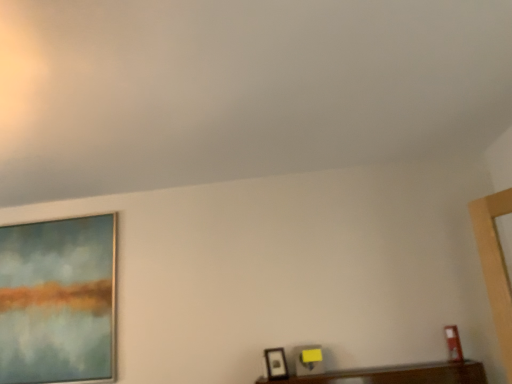
Where is `matte black picture frame at lower center, positioned as the second picture frame in left-to-right order`? This screenshot has height=384, width=512. matte black picture frame at lower center, positioned as the second picture frame in left-to-right order is located at coordinates (276, 364).

You are a GUI agent. You are given a task and a screenshot of the screen. Output one action in this format:
    pyautogui.click(x=<x>, y=<y>)
    Task: Click on the matte black picture frame at lower center, positioned as the second picture frame in left-to-right order
    
    Given the screenshot: What is the action you would take?
    pyautogui.click(x=276, y=364)

Which of these two, matte glass painting at left, acting as the third picture frame starting from the right, or matte black picture frame at lower center, the second picture frame positioned from the front, is wider?

Wider between the two is matte black picture frame at lower center, the second picture frame positioned from the front.

Considering the relative sizes of matte glass painting at left, which is counted as the 3th picture frame, starting from the front, and matte black picture frame at lower center, arranged as the 2th picture frame when viewed from the back, in the image provided, is matte glass painting at left, which is counted as the 3th picture frame, starting from the front, bigger than matte black picture frame at lower center, arranged as the 2th picture frame when viewed from the back,?

Yes, matte glass painting at left, which is counted as the 3th picture frame, starting from the front, is bigger than matte black picture frame at lower center, arranged as the 2th picture frame when viewed from the back.

Who is shorter, matte glass painting at left, acting as the third picture frame starting from the right, or matte black picture frame at lower center, the second picture frame from the right?

With less height is matte black picture frame at lower center, the second picture frame from the right.

Is matte black picture frame at lower center, positioned as the second picture frame in left-to-right order, inside or outside of matte black picture frame at lower right, the 1th picture frame positioned from the front?

matte black picture frame at lower center, positioned as the second picture frame in left-to-right order, cannot be found inside matte black picture frame at lower right, the 1th picture frame positioned from the front.

Is point (281, 364) positioned behind point (455, 339)?

Yes, point (281, 364) is behind point (455, 339).

Considering the sizes of objects matte black picture frame at lower center, the second picture frame positioned from the front, and matte black picture frame at lower right, the 1th picture frame from the right, in the image provided, who is bigger, matte black picture frame at lower center, the second picture frame positioned from the front, or matte black picture frame at lower right, the 1th picture frame from the right,?

Bigger between the two is matte black picture frame at lower center, the second picture frame positioned from the front.

Can you see matte black picture frame at lower center, arranged as the 2th picture frame when viewed from the back, touching matte black picture frame at lower right, the 3th picture frame positioned from the back?

No, matte black picture frame at lower center, arranged as the 2th picture frame when viewed from the back, is not making contact with matte black picture frame at lower right, the 3th picture frame positioned from the back.

Is matte black picture frame at lower right, the 1th picture frame positioned from the front, located within matte glass painting at left, which is counted as the 3th picture frame, starting from the front?

No, matte black picture frame at lower right, the 1th picture frame positioned from the front, is not a part of matte glass painting at left, which is counted as the 3th picture frame, starting from the front.

Which is behind, point (111, 335) or point (453, 340)?

The point (111, 335) is farther.

Is matte glass painting at left, acting as the third picture frame starting from the right, touching matte black picture frame at lower right, the 1th picture frame positioned from the front?

matte glass painting at left, acting as the third picture frame starting from the right, and matte black picture frame at lower right, the 1th picture frame positioned from the front, are clearly separated.

Considering the relative sizes of matte glass painting at left, acting as the third picture frame starting from the right, and matte black picture frame at lower right, the 3th picture frame positioned from the back, in the image provided, is matte glass painting at left, acting as the third picture frame starting from the right, taller than matte black picture frame at lower right, the 3th picture frame positioned from the back,?

Correct, matte glass painting at left, acting as the third picture frame starting from the right, is much taller as matte black picture frame at lower right, the 3th picture frame positioned from the back.

Is matte black picture frame at lower center, the second picture frame positioned from the front, facing towards matte glass painting at left, acting as the third picture frame starting from the right?

No, matte black picture frame at lower center, the second picture frame positioned from the front, is not aimed at matte glass painting at left, acting as the third picture frame starting from the right.

Is matte black picture frame at lower center, the second picture frame from the right, located outside matte glass painting at left, which is the 1th picture frame from back to front?

matte black picture frame at lower center, the second picture frame from the right, is positioned outside matte glass painting at left, which is the 1th picture frame from back to front.

Is point (280, 371) farther from camera compared to point (37, 353)?

No, it is not.

Does matte black picture frame at lower right, the 1th picture frame positioned from the front, come in front of matte glass painting at left, which is counted as the 3th picture frame, starting from the front?

Yes, matte black picture frame at lower right, the 1th picture frame positioned from the front, is in front of matte glass painting at left, which is counted as the 3th picture frame, starting from the front.

Is matte black picture frame at lower right, the 1th picture frame from the right, bigger than matte glass painting at left, positioned as the first picture frame in left-to-right order?

No, matte black picture frame at lower right, the 1th picture frame from the right, is not bigger than matte glass painting at left, positioned as the first picture frame in left-to-right order.

This screenshot has height=384, width=512. In order to click on picture frame that appears above the matte black picture frame at lower right, the 1th picture frame from the right (from a real-world perspective) in this screenshot , I will do `click(58, 301)`.

Is matte black picture frame at lower right, which is counted as the third picture frame, starting from the left, positioned far away from matte black picture frame at lower center, arranged as the 2th picture frame when viewed from the back?

Indeed, matte black picture frame at lower right, which is counted as the third picture frame, starting from the left, is not near matte black picture frame at lower center, arranged as the 2th picture frame when viewed from the back.

Is the position of matte black picture frame at lower right, the 1th picture frame from the right, more distant than that of matte black picture frame at lower center, arranged as the 2th picture frame when viewed from the back?

No, matte black picture frame at lower right, the 1th picture frame from the right, is in front of matte black picture frame at lower center, arranged as the 2th picture frame when viewed from the back.

Is matte black picture frame at lower right, the 1th picture frame positioned from the front, taller than matte black picture frame at lower center, the second picture frame positioned from the front?

Yes.

Find the location of `the 1st picture frame in front when counting from the matte glass painting at left, which is the 1th picture frame from back to front`. the 1st picture frame in front when counting from the matte glass painting at left, which is the 1th picture frame from back to front is located at coordinates (276, 364).

This screenshot has width=512, height=384. There is a matte black picture frame at lower center, arranged as the 2th picture frame when viewed from the back. In order to click on the 1st picture frame above it (from a real-world perspective) in this screenshot , I will do `click(453, 343)`.

Which object lies further to the anchor point matte glass painting at left, acting as the third picture frame starting from the right, matte black picture frame at lower center, the second picture frame from the right, or matte black picture frame at lower right, the 1th picture frame from the right?

matte black picture frame at lower right, the 1th picture frame from the right, is further to matte glass painting at left, acting as the third picture frame starting from the right.

When comparing their distances from matte glass painting at left, which is the 1th picture frame from back to front, does matte black picture frame at lower right, the 1th picture frame from the right, or matte black picture frame at lower center, the second picture frame from the right, seem further?

matte black picture frame at lower right, the 1th picture frame from the right.

Considering their positions, is matte glass painting at left, which is counted as the 3th picture frame, starting from the front, positioned closer to matte black picture frame at lower right, the 1th picture frame positioned from the front, than matte black picture frame at lower center, the second picture frame from the right?

matte black picture frame at lower center, the second picture frame from the right.

Which object lies further to the anchor point matte black picture frame at lower center, positioned as the second picture frame in left-to-right order, matte black picture frame at lower right, the 3th picture frame positioned from the back, or matte glass painting at left, which is counted as the 3th picture frame, starting from the front?

Based on the image, matte glass painting at left, which is counted as the 3th picture frame, starting from the front, appears to be further to matte black picture frame at lower center, positioned as the second picture frame in left-to-right order.

Estimate the real-world distances between objects in this image. Which object is further from matte black picture frame at lower center, arranged as the 2th picture frame when viewed from the back, matte glass painting at left, acting as the third picture frame starting from the right, or matte black picture frame at lower right, the 1th picture frame positioned from the front?

The object further to matte black picture frame at lower center, arranged as the 2th picture frame when viewed from the back, is matte glass painting at left, acting as the third picture frame starting from the right.

From the image, which object appears to be farther from matte black picture frame at lower right, which is counted as the third picture frame, starting from the left, matte black picture frame at lower center, positioned as the second picture frame in left-to-right order, or matte glass painting at left, positioned as the first picture frame in left-to-right order?

Based on the image, matte glass painting at left, positioned as the first picture frame in left-to-right order, appears to be further to matte black picture frame at lower right, which is counted as the third picture frame, starting from the left.

Locate an element on the screen. picture frame between matte glass painting at left, acting as the third picture frame starting from the right, and matte black picture frame at lower right, the 1th picture frame from the right, from left to right is located at coordinates (276, 364).